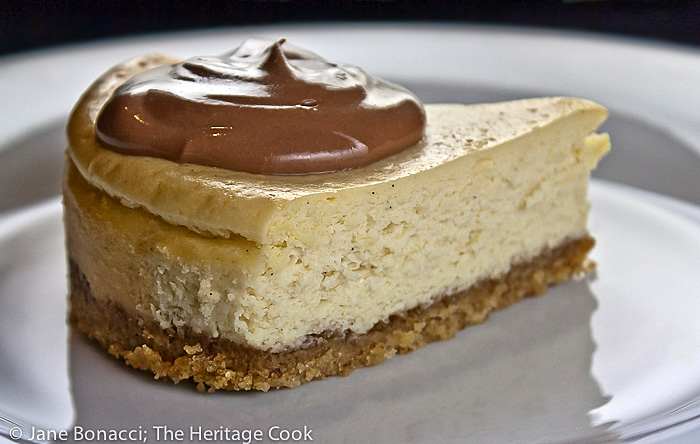
Locate an element on the screen. This screenshot has width=700, height=444. plate is located at coordinates (448, 398).